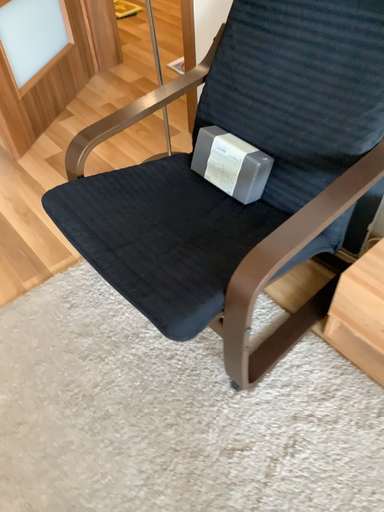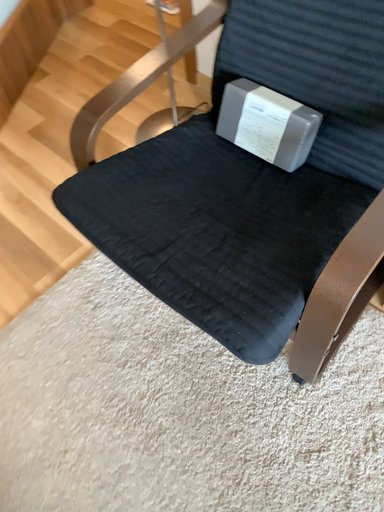
Question: Which way did the camera rotate in the video?

Choices:
 (A) rotated upward
 (B) rotated downward

Answer: (B)